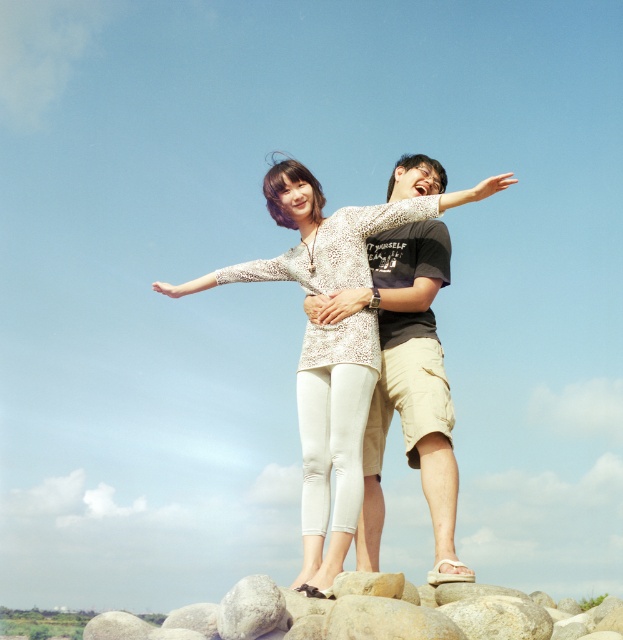
Question: Which point appears closest to the camera in this image?

Choices:
 (A) (373, 424)
 (B) (310, 502)

Answer: (B)

Question: Is black cotton t-shirt at center to the left of smooth gray rock at lower center from the viewer's perspective?

Choices:
 (A) yes
 (B) no

Answer: (B)

Question: In this image, where is black cotton t-shirt at center located relative to smooth gray rock at lower center?

Choices:
 (A) right
 (B) left

Answer: (A)

Question: Which of these objects is positioned closest to the white lace blouse at center?

Choices:
 (A) black cotton t-shirt at center
 (B) smooth gray rock at lower center

Answer: (A)

Question: Which of the following is the closest to the observer?

Choices:
 (A) (305, 532)
 (B) (535, 632)

Answer: (B)

Question: Is white lace blouse at center smaller than black cotton t-shirt at center?

Choices:
 (A) no
 (B) yes

Answer: (B)